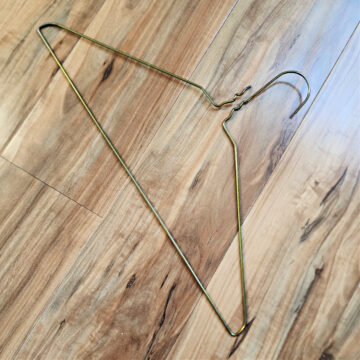
The image size is (360, 360). I want to click on end of hook on hager, so click(x=291, y=114).